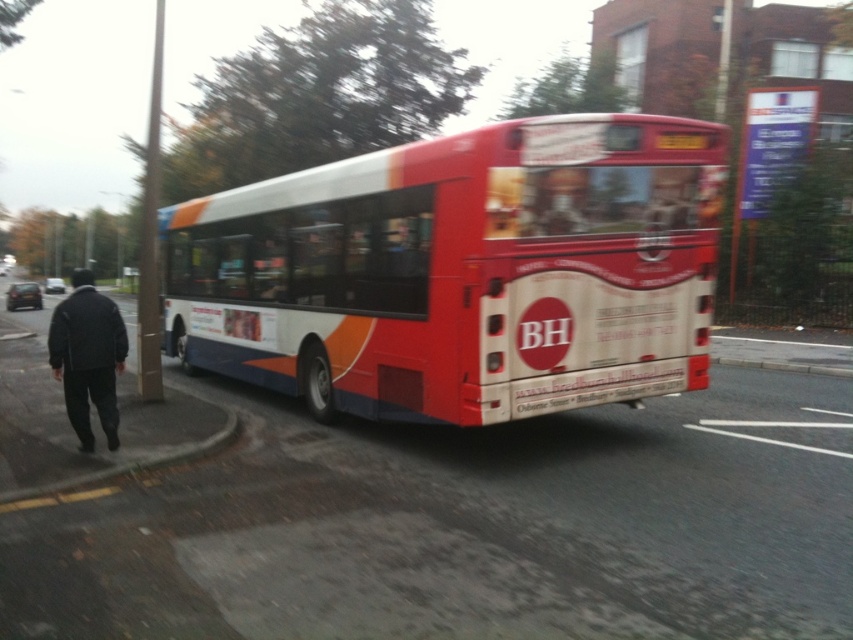
You are a pedestrian standing near the road and see the red matte bus at center and the dark gray jacket at left. Which object is taller?

The dark gray jacket at left is taller than the red matte bus at center.

You are a pedestrian trying to cross the road safely. You see the red matte bus at center and the dark gray jacket at left. Which object is closer to you as you stand at the crosswalk?

The dark gray jacket at left is closer to you because it is only 12.07 feet away from the red matte bus at center, but since you are at the crosswalk, the jacket is nearer than the bus.

You are a pedestrian standing at the edge of the road and see the red matte bus at center and the dark gray jacket at left. Which object is closer to the right side of the road?

The red matte bus at center is positioned on the right side of dark gray jacket at left, meaning it is closer to the right side of the road.